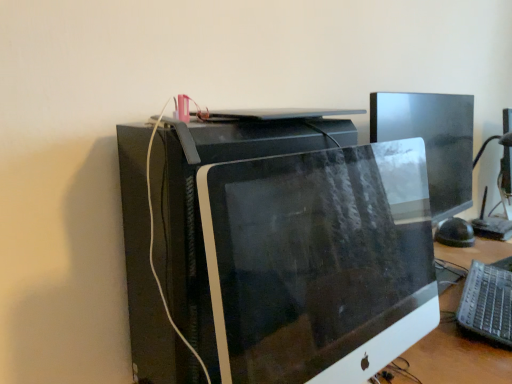
Measure the distance between silver metallic keyboard at lower right and camera.

silver metallic keyboard at lower right is 36.26 inches from camera.

In order to face silver metallic keyboard at lower right, should I rotate leftwards or rightwards?

To align with it, rotate right about 29.339°.

What is the approximate height of silver metallic keyboard at lower right?

silver metallic keyboard at lower right is 1.81 inches in height.

Where is `silver metallic keyboard at lower right`? This screenshot has height=384, width=512. silver metallic keyboard at lower right is located at coordinates (487, 303).

Image resolution: width=512 pixels, height=384 pixels. What do you see at coordinates (487, 303) in the screenshot?
I see `silver metallic keyboard at lower right` at bounding box center [487, 303].

Describe the element at coordinates (291, 246) in the screenshot. The width and height of the screenshot is (512, 384). I see `matte black monitor at center` at that location.

This screenshot has height=384, width=512. I want to click on matte black monitor at center, so click(x=291, y=246).

Measure the distance between point (250, 203) and camera.

The depth of point (250, 203) is 3.74 feet.

Identify the location of silver metallic keyboard at lower right. click(x=487, y=303).

Between matte black monitor at center and silver metallic keyboard at lower right, which one appears on the left side from the viewer's perspective?

matte black monitor at center is more to the left.

Which object is closer to the camera taking this photo, matte black monitor at center or silver metallic keyboard at lower right?

matte black monitor at center.

Is point (181, 170) more distant than point (469, 305)?

No.

From the image's perspective, is matte black monitor at center positioned above or below silver metallic keyboard at lower right?

matte black monitor at center is situated higher than silver metallic keyboard at lower right in the image.

From the picture: From a real-world perspective, is matte black monitor at center above or below silver metallic keyboard at lower right?

In terms of real-world spatial position, matte black monitor at center is above silver metallic keyboard at lower right.

Considering the relative sizes of matte black monitor at center and silver metallic keyboard at lower right in the image provided, is matte black monitor at center thinner than silver metallic keyboard at lower right?

In fact, matte black monitor at center might be wider than silver metallic keyboard at lower right.

Between matte black monitor at center and silver metallic keyboard at lower right, which one has less height?

silver metallic keyboard at lower right is shorter.

Is matte black monitor at center bigger than silver metallic keyboard at lower right?

Yes, matte black monitor at center is bigger than silver metallic keyboard at lower right.

In the scene shown: Choose the correct answer: Is matte black monitor at center inside silver metallic keyboard at lower right or outside it?

matte black monitor at center is not inside silver metallic keyboard at lower right, it's outside.

Is matte black monitor at center next to silver metallic keyboard at lower right and touching it?

matte black monitor at center and silver metallic keyboard at lower right are not in contact.

Is matte black monitor at center positioned with its back to silver metallic keyboard at lower right?

matte black monitor at center is not turned away from silver metallic keyboard at lower right.

The width and height of the screenshot is (512, 384). I want to click on computer keyboard to the right of matte black monitor at center, so click(x=487, y=303).

Considering the relative positions of silver metallic keyboard at lower right and matte black monitor at center in the image provided, is silver metallic keyboard at lower right to the left of matte black monitor at center from the viewer's perspective?

Incorrect, silver metallic keyboard at lower right is not on the left side of matte black monitor at center.

Who is more distant, silver metallic keyboard at lower right or matte black monitor at center?

silver metallic keyboard at lower right is further from the camera.

Considering the positions of points (499, 270) and (195, 197), is point (499, 270) farther from camera compared to point (195, 197)?

Yes, it is.

From the image's perspective, which one is positioned higher, silver metallic keyboard at lower right or matte black monitor at center?

matte black monitor at center is shown above in the image.

From a real-world perspective, which object rests below the other?

silver metallic keyboard at lower right.

In terms of width, does silver metallic keyboard at lower right look wider or thinner when compared to matte black monitor at center?

In the image, silver metallic keyboard at lower right appears to be more narrow than matte black monitor at center.

Is silver metallic keyboard at lower right taller than matte black monitor at center?

No, silver metallic keyboard at lower right is not taller than matte black monitor at center.

Considering the relative sizes of silver metallic keyboard at lower right and matte black monitor at center in the image provided, is silver metallic keyboard at lower right smaller than matte black monitor at center?

Yes, silver metallic keyboard at lower right is smaller than matte black monitor at center.

Is silver metallic keyboard at lower right not inside matte black monitor at center?

Yes.

Is silver metallic keyboard at lower right directly adjacent to matte black monitor at center?

silver metallic keyboard at lower right is not next to matte black monitor at center, and they're not touching.

Is silver metallic keyboard at lower right positioned with its back to matte black monitor at center?

No, silver metallic keyboard at lower right is not facing the opposite direction of matte black monitor at center.

Where is `computer keyboard that is under the matte black monitor at center (from a real-world perspective)`? computer keyboard that is under the matte black monitor at center (from a real-world perspective) is located at coordinates (487, 303).

Find the location of a particular element. computer keyboard below the matte black monitor at center (from the image's perspective) is located at coordinates (487, 303).

This screenshot has height=384, width=512. Identify the location of computer keyboard below the matte black monitor at center (from a real-world perspective). (487, 303).